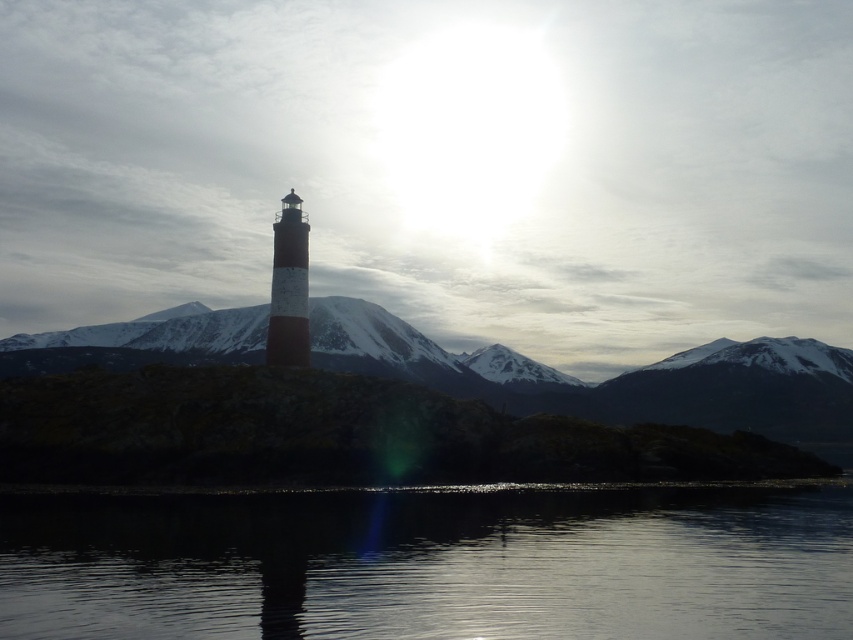
Looking at this image, can you confirm if transparent glass water at center is wider than white painted metal lighthouse at center?

Correct, the width of transparent glass water at center exceeds that of white painted metal lighthouse at center.

Is transparent glass water at center bigger than white painted metal lighthouse at center?

Yes.

This screenshot has width=853, height=640. Identify the location of transparent glass water at center. (431, 563).